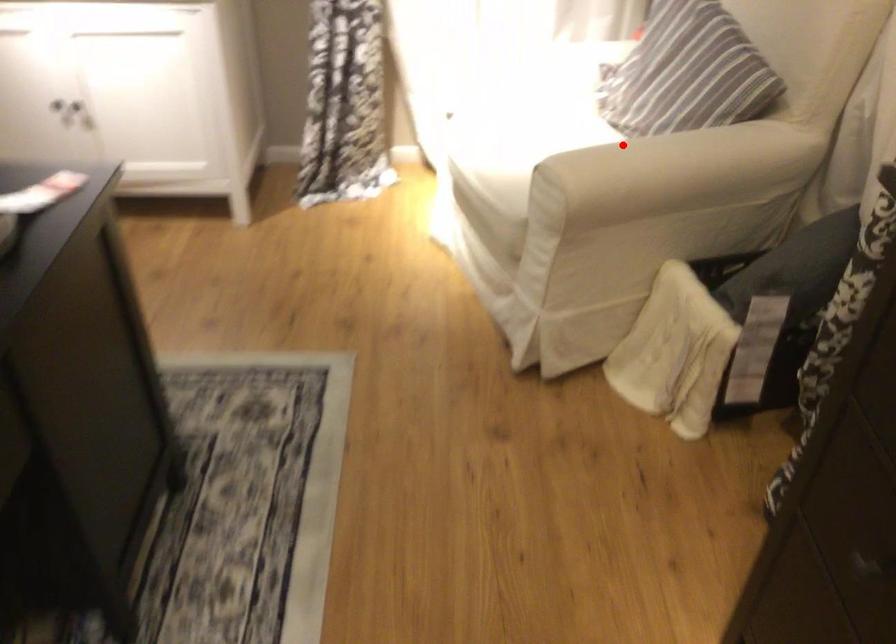
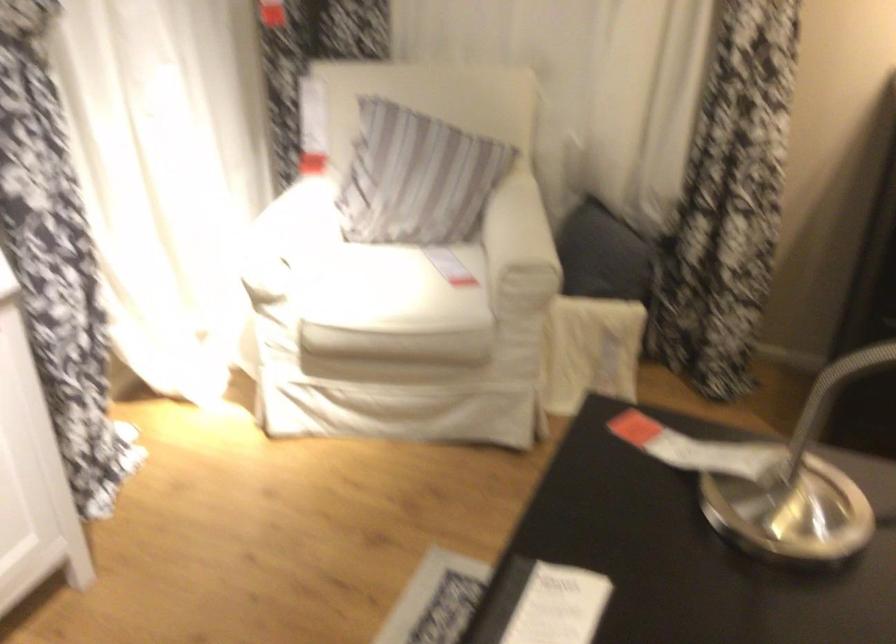
Find the pixel in the second image that matches the highlighted location in the first image.

(509, 228)